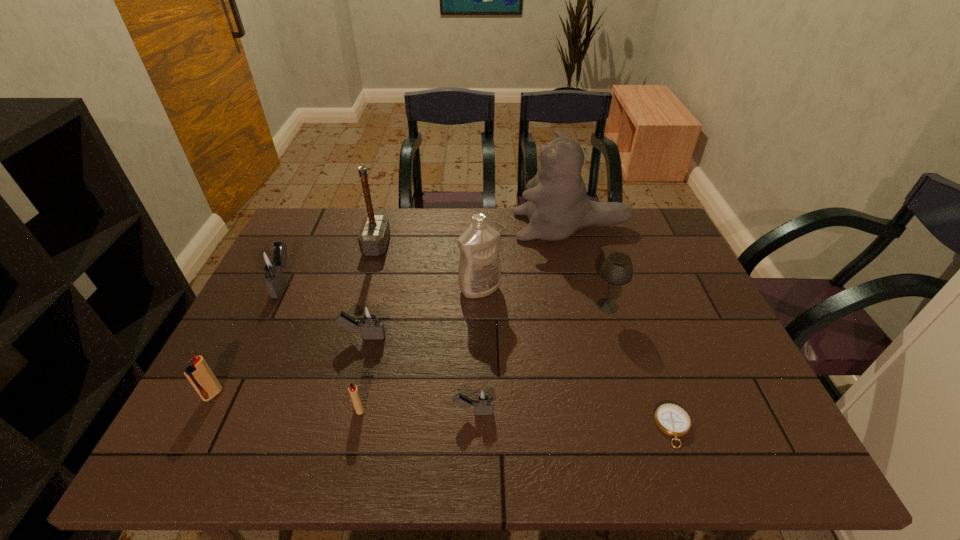
Where is `green cat`? This screenshot has height=540, width=960. green cat is located at coordinates (558, 206).

Where is `brown hammer`? brown hammer is located at coordinates (373, 237).

Where is `white detergent`? The height and width of the screenshot is (540, 960). white detergent is located at coordinates (479, 274).

This screenshot has height=540, width=960. In order to click on wineglass in this screenshot , I will do `click(617, 269)`.

This screenshot has width=960, height=540. In order to click on the biggest gray igniter in this screenshot , I will do `click(271, 262)`.

The width and height of the screenshot is (960, 540). In order to click on the farthest igniter in this screenshot , I will do `click(271, 262)`.

Find the location of `the second gray igniter from left to right`. the second gray igniter from left to right is located at coordinates (369, 318).

This screenshot has width=960, height=540. What are the coordinates of `the second farthest igniter` in the screenshot? It's located at (369, 318).

Find the location of `the farther red igniter`. the farther red igniter is located at coordinates (199, 374).

Find the location of `the fourth nearest object`. the fourth nearest object is located at coordinates (199, 374).